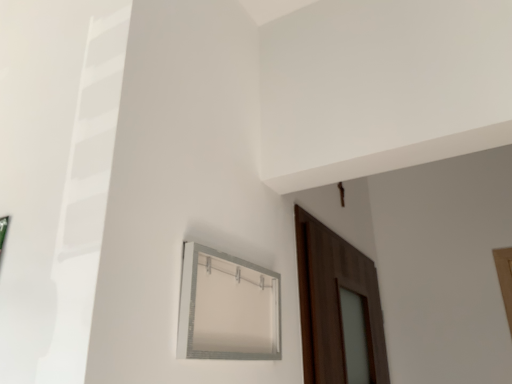
Describe the element at coordinates (227, 308) in the screenshot. The image size is (512, 384). I see `white plastic window frame at upper center` at that location.

Where is `white plastic window frame at upper center`? The image size is (512, 384). white plastic window frame at upper center is located at coordinates (227, 308).

Where is `white plastic window frame at upper center`? The width and height of the screenshot is (512, 384). white plastic window frame at upper center is located at coordinates (227, 308).